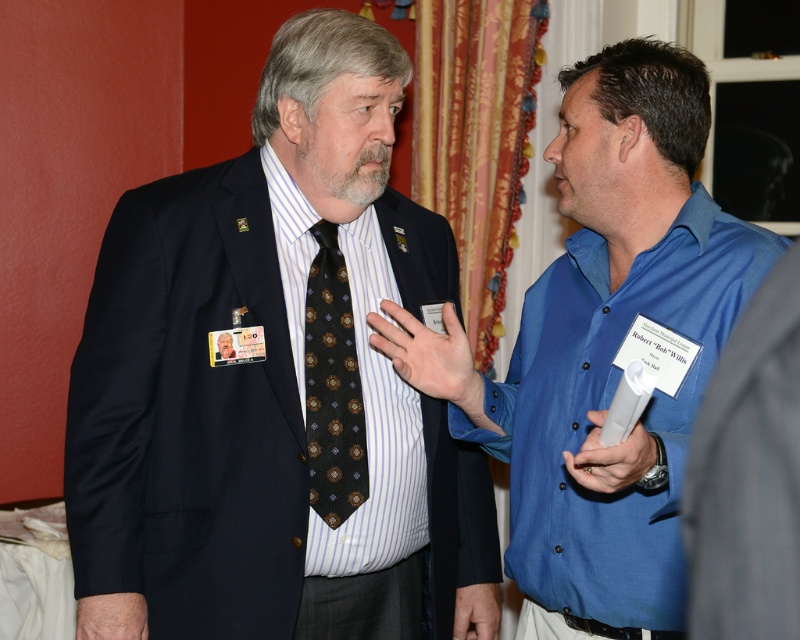
Does blue button-down shirt at center lie behind striped cotton shirt at left?

No, blue button-down shirt at center is in front of striped cotton shirt at left.

Is the position of blue button-down shirt at center less distant than that of striped cotton shirt at left?

Yes, blue button-down shirt at center is closer to the viewer.

Describe the element at coordinates (604, 348) in the screenshot. I see `blue button-down shirt at center` at that location.

Identify the location of blue button-down shirt at center. (604, 348).

Does blue button-down shirt at center appear on the right side of dark brown silk tie at center?

Indeed, blue button-down shirt at center is positioned on the right side of dark brown silk tie at center.

Can you confirm if blue button-down shirt at center is smaller than dark brown silk tie at center?

Incorrect, blue button-down shirt at center is not smaller in size than dark brown silk tie at center.

Where is `blue button-down shirt at center`? blue button-down shirt at center is located at coordinates (604, 348).

Is striped cotton shirt at left behind dark brown silk tie at center?

No, striped cotton shirt at left is in front of dark brown silk tie at center.

Can you confirm if striped cotton shirt at left is smaller than dark brown silk tie at center?

Actually, striped cotton shirt at left might be larger than dark brown silk tie at center.

Who is more forward, (396, 451) or (320, 406)?

Point (320, 406)

At what (x,y) coordinates should I click in order to perform the action: click on striped cotton shirt at left. Please return your answer as a coordinate pair (x, y). The image size is (800, 640). Looking at the image, I should click on (376, 432).